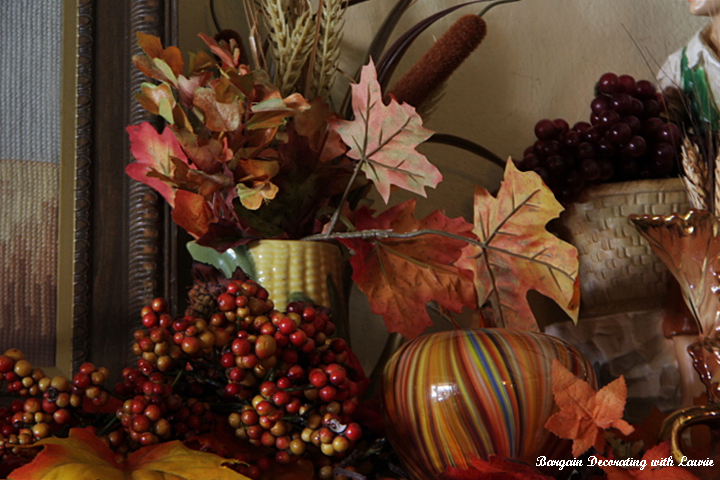
At what (x,y) coordinates should I click in order to perform the action: click on ceramic leaf. Please return your answer as a coordinate pair (x, y). Looking at the image, I should click on (695, 289).